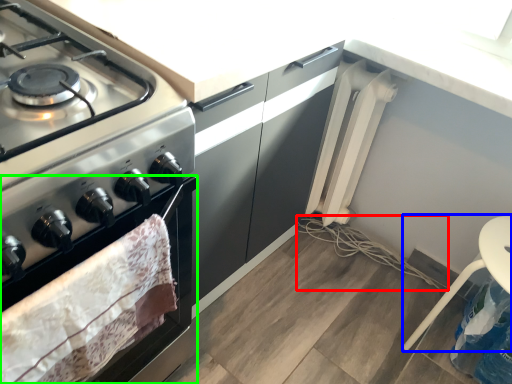
Question: Estimate the real-world distances between objects in this image. Which object is closer to string (highlighted by a red box), chair (highlighted by a blue box) or oven (highlighted by a green box)?

Choices:
 (A) chair
 (B) oven

Answer: (A)